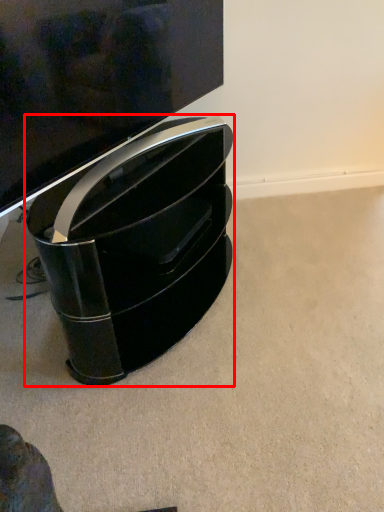
Question: From the image's perspective, where is furniture (annotated by the red box) located relative to television?

Choices:
 (A) above
 (B) below

Answer: (B)